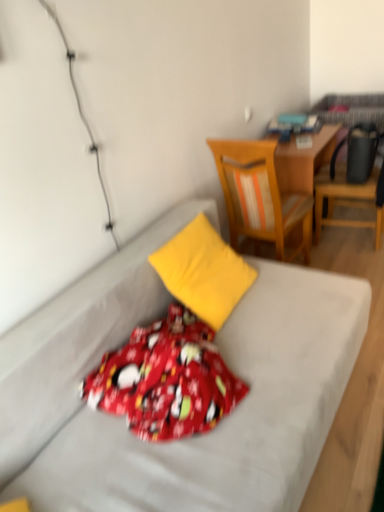
The height and width of the screenshot is (512, 384). Describe the element at coordinates (194, 437) in the screenshot. I see `yellow fabric bed at center` at that location.

The height and width of the screenshot is (512, 384). What do you see at coordinates (259, 196) in the screenshot? I see `wooden chair at upper right, which is the 1th chair in left-to-right order` at bounding box center [259, 196].

In order to click on wooden chair at upper right, which is the 1th chair in left-to-right order in this screenshot , I will do `click(259, 196)`.

What do you see at coordinates (348, 199) in the screenshot? The height and width of the screenshot is (512, 384). I see `wooden chair at upper right, the second chair positioned from the left` at bounding box center [348, 199].

This screenshot has height=512, width=384. I want to click on yellow fabric bed at center, so click(x=194, y=437).

How different are the orientations of wooden desk at center and wooden chair at upper right, positioned as the first chair in right-to-left order, in degrees?

wooden desk at center and wooden chair at upper right, positioned as the first chair in right-to-left order, are facing 179 degrees away from each other.

I want to click on desk that appears below the wooden chair at upper right, the second chair positioned from the left (from a real-world perspective), so click(x=304, y=160).

Who is taller, wooden desk at center or wooden chair at upper right, the second chair positioned from the left?

With more height is wooden chair at upper right, the second chair positioned from the left.

Considering the relative positions of wooden desk at center and wooden chair at upper right, the second chair positioned from the left, in the image provided, is wooden desk at center to the left of wooden chair at upper right, the second chair positioned from the left, from the viewer's perspective?

Yes, wooden desk at center is to the left of wooden chair at upper right, the second chair positioned from the left.

Can you confirm if yellow fabric pillow at center is taller than wooden chair at upper right, positioned as the first chair in right-to-left order?

In fact, yellow fabric pillow at center may be shorter than wooden chair at upper right, positioned as the first chair in right-to-left order.

From a real-world perspective, which object stands above the other?

From a 3D spatial view, yellow fabric pillow at center is above.

Does yellow fabric pillow at center turn towards wooden chair at upper right, positioned as the first chair in right-to-left order?

No, yellow fabric pillow at center is not facing towards wooden chair at upper right, positioned as the first chair in right-to-left order.

Can you confirm if yellow fabric pillow at center is bigger than wooden chair at upper right, the second chair positioned from the left?

No.

Starting from the wooden desk at center, which chair is the 2nd one in front? Please provide its 2D coordinates.

[(259, 196)]

Does wooden desk at center have a lesser height compared to wooden chair at upper right, the second chair from the right?

Yes, wooden desk at center is shorter than wooden chair at upper right, the second chair from the right.

Is wooden desk at center thinner than wooden chair at upper right, which is the 1th chair in left-to-right order?

Correct, the width of wooden desk at center is less than that of wooden chair at upper right, which is the 1th chair in left-to-right order.

How far apart are wooden desk at center and wooden chair at upper right, the second chair from the right?

wooden desk at center and wooden chair at upper right, the second chair from the right, are 15.18 inches apart from each other.

Where is `pillow located above the wooden desk at center (from a real-world perspective)`? This screenshot has height=512, width=384. pillow located above the wooden desk at center (from a real-world perspective) is located at coordinates (203, 271).

Considering the relative sizes of wooden desk at center and yellow fabric pillow at center in the image provided, is wooden desk at center shorter than yellow fabric pillow at center?

Incorrect, the height of wooden desk at center does not fall short of that of yellow fabric pillow at center.

Between wooden desk at center and yellow fabric pillow at center, which one is positioned behind?

wooden desk at center is further from the camera.

From the picture: Between wooden desk at center and yellow fabric pillow at center, which one has larger size?

Bigger between the two is wooden desk at center.

From the image's perspective, is wooden chair at upper right, the second chair positioned from the left, positioned above or below wooden chair at upper right, which is the 1th chair in left-to-right order?

Clearly, from the image's perspective, wooden chair at upper right, the second chair positioned from the left, is above wooden chair at upper right, which is the 1th chair in left-to-right order.

From a real-world perspective, between wooden chair at upper right, the second chair positioned from the left, and wooden chair at upper right, which is the 1th chair in left-to-right order, who is vertically lower?

wooden chair at upper right, the second chair positioned from the left, is physically lower.

Is wooden chair at upper right, which is the 1th chair in left-to-right order, at the back of wooden chair at upper right, the second chair positioned from the left?

wooden chair at upper right, the second chair positioned from the left, does not have its back to wooden chair at upper right, which is the 1th chair in left-to-right order.

Is wooden chair at upper right, the second chair positioned from the left, taller than wooden chair at upper right, the second chair from the right?

No, wooden chair at upper right, the second chair positioned from the left, is not taller than wooden chair at upper right, the second chair from the right.

Measure the distance between red cotton blanket at center and yellow fabric bed at center.

The distance of red cotton blanket at center from yellow fabric bed at center is 17.75 centimeters.

Does red cotton blanket at center have a larger size compared to yellow fabric bed at center?

No.

Considering the relative sizes of red cotton blanket at center and yellow fabric bed at center in the image provided, is red cotton blanket at center wider than yellow fabric bed at center?

No, red cotton blanket at center is not wider than yellow fabric bed at center.

Is red cotton blanket at center outside of yellow fabric bed at center?

No, red cotton blanket at center is not entirely external to yellow fabric bed at center.

Does wooden chair at upper right, which is the 1th chair in left-to-right order, appear on the right side of yellow fabric bed at center?

Yes.

From the image's perspective, is wooden chair at upper right, the second chair from the right, positioned above or below yellow fabric bed at center?

wooden chair at upper right, the second chair from the right, is situated higher than yellow fabric bed at center in the image.

Is wooden chair at upper right, which is the 1th chair in left-to-right order, touching yellow fabric bed at center?

No.

Is yellow fabric bed at center surrounded by wooden chair at upper right, the second chair from the right?

No, yellow fabric bed at center is not inside wooden chair at upper right, the second chair from the right.

Which chair is the 1st one when counting from the front of the wooden desk at center? Please provide its 2D coordinates.

[(348, 199)]

Find the location of a particular element. This screenshot has width=384, height=512. pillow above the wooden chair at upper right, the second chair positioned from the left (from a real-world perspective) is located at coordinates (203, 271).

Estimate the real-world distances between objects in this image. Which object is closer to wooden desk at center, yellow fabric pillow at center or wooden chair at upper right, the second chair from the right?

wooden chair at upper right, the second chair from the right, lies closer to wooden desk at center than the other object.

Based on their spatial positions, is yellow fabric bed at center or wooden chair at upper right, positioned as the first chair in right-to-left order, further from wooden chair at upper right, which is the 1th chair in left-to-right order?

yellow fabric bed at center.

Which object lies further to the anchor point yellow fabric bed at center, yellow fabric pillow at center or wooden desk at center?

Based on the image, wooden desk at center appears to be further to yellow fabric bed at center.

From the image, which object appears to be nearer to red cotton blanket at center, wooden chair at upper right, the second chair positioned from the left, or yellow fabric pillow at center?

The object closer to red cotton blanket at center is yellow fabric pillow at center.

When comparing their distances from yellow fabric bed at center, does red cotton blanket at center or yellow fabric pillow at center seem further?

yellow fabric pillow at center is further to yellow fabric bed at center.

Estimate the real-world distances between objects in this image. Which object is closer to red cotton blanket at center, yellow fabric bed at center or wooden chair at upper right, the second chair positioned from the left?

yellow fabric bed at center is closer to red cotton blanket at center.

Based on their spatial positions, is yellow fabric bed at center or wooden chair at upper right, the second chair from the right, further from red cotton blanket at center?

wooden chair at upper right, the second chair from the right.

Based on their spatial positions, is wooden chair at upper right, which is the 1th chair in left-to-right order, or yellow fabric bed at center further from wooden chair at upper right, positioned as the first chair in right-to-left order?

Among the two, yellow fabric bed at center is located further to wooden chair at upper right, positioned as the first chair in right-to-left order.

At what (x,y) coordinates should I click in order to perform the action: click on pillow located between yellow fabric bed at center and wooden chair at upper right, which is the 1th chair in left-to-right order, in the depth direction. Please return your answer as a coordinate pair (x, y). This screenshot has width=384, height=512. Looking at the image, I should click on (203, 271).

The width and height of the screenshot is (384, 512). What are the coordinates of `pillow between red cotton blanket at center and wooden chair at upper right, the second chair from the right, along the z-axis` in the screenshot? It's located at (203, 271).

Identify the location of chair between red cotton blanket at center and wooden chair at upper right, the second chair positioned from the left, from front to back. (259, 196).

At what (x,y) coordinates should I click in order to perform the action: click on pillow positioned between red cotton blanket at center and wooden desk at center from near to far. Please return your answer as a coordinate pair (x, y). Looking at the image, I should click on (203, 271).